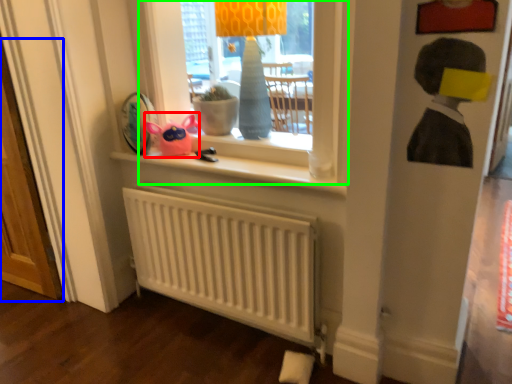
Question: Which object is positioned farthest from toy (highlighted by a red box)? Select from screen door (highlighted by a blue box) and window (highlighted by a green box).

Choices:
 (A) screen door
 (B) window

Answer: (A)